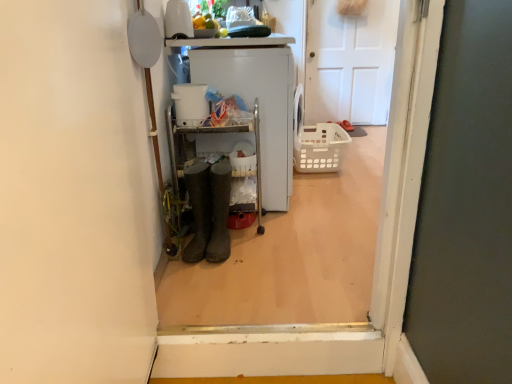
Question: Would you say white matte door at center is inside or outside brown leather boots at center, the 2th footwear when ordered from right to left?

Choices:
 (A) outside
 (B) inside

Answer: (A)

Question: Is white matte door at center to the left or to the right of brown leather boots at center, arranged as the first footwear when viewed from the left, in the image?

Choices:
 (A) right
 (B) left

Answer: (A)

Question: Estimate the real-world distances between objects in this image. Which object is farther from the white plastic washing machine at center?

Choices:
 (A) translucent plastic basket at center
 (B) brown rubber boots at center, arranged as the 1th footwear when viewed from the right
 (C) white matte door at center
 (D) matte rubber boots at center
 (E) brown leather boots at center, the 2th footwear when ordered from right to left

Answer: (C)

Question: Which object is the closest to the brown leather boots at center, the 2th footwear when ordered from right to left?

Choices:
 (A) white matte door at center
 (B) white plastic washing machine at center
 (C) brown rubber boots at center, arranged as the 1th footwear when viewed from the right
 (D) translucent plastic basket at center
 (E) matte rubber boots at center

Answer: (C)